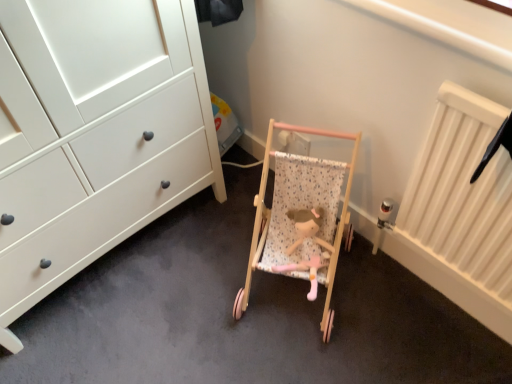
The width and height of the screenshot is (512, 384). Describe the element at coordinates (308, 246) in the screenshot. I see `wooden doll at center` at that location.

Identify the location of wooden doll at center. This screenshot has height=384, width=512. (308, 246).

In order to face wooden doll at center, should I rotate leftwards or rightwards?

You should look right and rotate roughly 6.823 degrees.

What do you see at coordinates (298, 222) in the screenshot? The height and width of the screenshot is (384, 512). I see `wooden stroller at center` at bounding box center [298, 222].

You are a GUI agent. You are given a task and a screenshot of the screen. Output one action in this format:
    pyautogui.click(x=<x>, y=<y>)
    Task: Click on the wooden stroller at center
    The width and height of the screenshot is (512, 384).
    Given the screenshot: What is the action you would take?
    pyautogui.click(x=298, y=222)

Locate an element on the screen. The height and width of the screenshot is (384, 512). wooden doll at center is located at coordinates (308, 246).

Based on the photo, considering the relative positions of wooden doll at center and wooden stroller at center in the image provided, is wooden doll at center to the right of wooden stroller at center from the viewer's perspective?

Indeed, wooden doll at center is positioned on the right side of wooden stroller at center.

Which object is further away from the camera taking this photo, wooden doll at center or wooden stroller at center?

wooden doll at center is behind.

Is point (322, 259) closer to camera compared to point (287, 220)?

Yes, it is in front of point (287, 220).

From the image's perspective, is wooden doll at center over wooden stroller at center?

No.

Looking at this image, from a real-world perspective, does wooden doll at center stand above wooden stroller at center?

No, from a real-world perspective, wooden doll at center is not over wooden stroller at center

Is wooden doll at center wider than wooden stroller at center?

In fact, wooden doll at center might be narrower than wooden stroller at center.

Is wooden doll at center taller than wooden stroller at center?

Incorrect, the height of wooden doll at center is not larger of that of wooden stroller at center.

Can you confirm if wooden doll at center is bigger than wooden stroller at center?

Incorrect, wooden doll at center is not larger than wooden stroller at center.

Is wooden doll at center inside or outside of wooden stroller at center?

wooden doll at center can be found inside wooden stroller at center.

Are wooden doll at center and wooden stroller at center making contact?

Absolutely, wooden doll at center is next to and touching wooden stroller at center.

Is wooden doll at center aimed at wooden stroller at center?

Yes, wooden doll at center is turned towards wooden stroller at center.

How many degrees apart are the facing directions of wooden doll at center and wooden stroller at center?

0.00246 degrees.

Measure the distance from wooden doll at center to wooden stroller at center.

2.64 inches.

What are the coordinates of `toy on the right of wooden stroller at center` in the screenshot? It's located at (308, 246).

Which object is positioned more to the left, wooden stroller at center or wooden doll at center?

wooden stroller at center is more to the left.

Which is in front, wooden stroller at center or wooden doll at center?

wooden stroller at center is more forward.

Is point (327, 188) closer or farther from the camera than point (319, 256)?

Point (327, 188).

From the image's perspective, is wooden stroller at center beneath wooden doll at center?

No, from the image's perspective, wooden stroller at center is not beneath wooden doll at center.

From a real-world perspective, is wooden stroller at center physically above wooden doll at center?

Yes, from a real-world perspective, wooden stroller at center is on top of wooden doll at center.

Can you confirm if wooden stroller at center is wider than wooden doll at center?

Yes.

Is wooden stroller at center shorter than wooden doll at center?

No, wooden stroller at center is not shorter than wooden doll at center.

Considering the sizes of wooden stroller at center and wooden doll at center in the image, is wooden stroller at center bigger or smaller than wooden doll at center?

Considering their sizes, wooden stroller at center takes up more space than wooden doll at center.

Is wooden stroller at center not within wooden doll at center?

That's correct, wooden stroller at center is outside of wooden doll at center.

In the scene shown: Would you consider wooden stroller at center to be distant from wooden doll at center?

They are positioned close to each other.

Is wooden doll at center at the back of wooden stroller at center?

Yes, wooden stroller at center's orientation is away from wooden doll at center.

The width and height of the screenshot is (512, 384). Identify the location of furniture to the left of wooden doll at center. (298, 222).

In order to click on toy on the right of wooden stroller at center in this screenshot , I will do `click(308, 246)`.

Where is `toy below the wooden stroller at center (from the image's perspective)`? toy below the wooden stroller at center (from the image's perspective) is located at coordinates (308, 246).